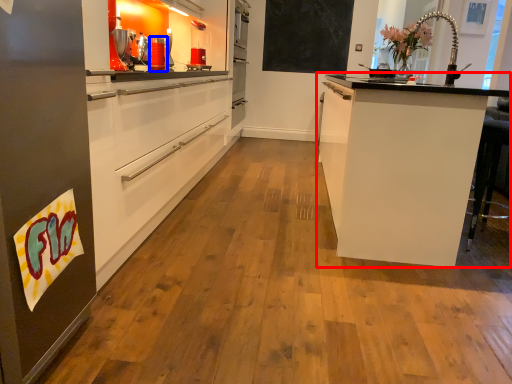
Question: Which object appears closest to the camera in this image, cabinetry (highlighted by a red box) or appliance (highlighted by a blue box)?

Choices:
 (A) cabinetry
 (B) appliance

Answer: (A)